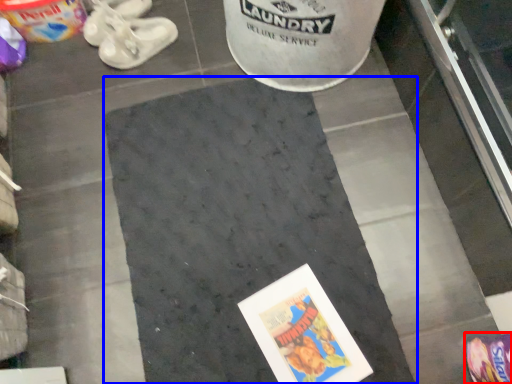
Question: Which point is closer to the camera, footwear (highlighted by a red box) or concrete (highlighted by a blue box)?

Choices:
 (A) footwear
 (B) concrete

Answer: (A)